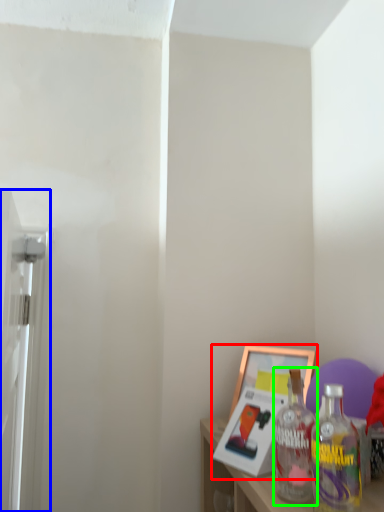
Question: Which object is the closest to the picture frame (highlighted by a red box)? Choose among these: screen door (highlighted by a blue box) or bottle (highlighted by a green box).

Choices:
 (A) screen door
 (B) bottle

Answer: (B)